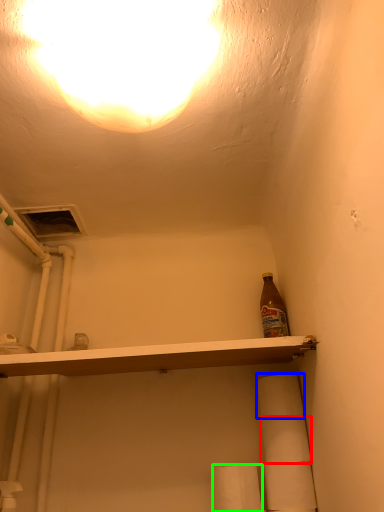
Question: Estimate the real-world distances between objects in this image. Which object is farther from toilet paper (highlighted by a red box), toilet paper (highlighted by a blue box) or toilet paper (highlighted by a green box)?

Choices:
 (A) toilet paper
 (B) toilet paper

Answer: (B)